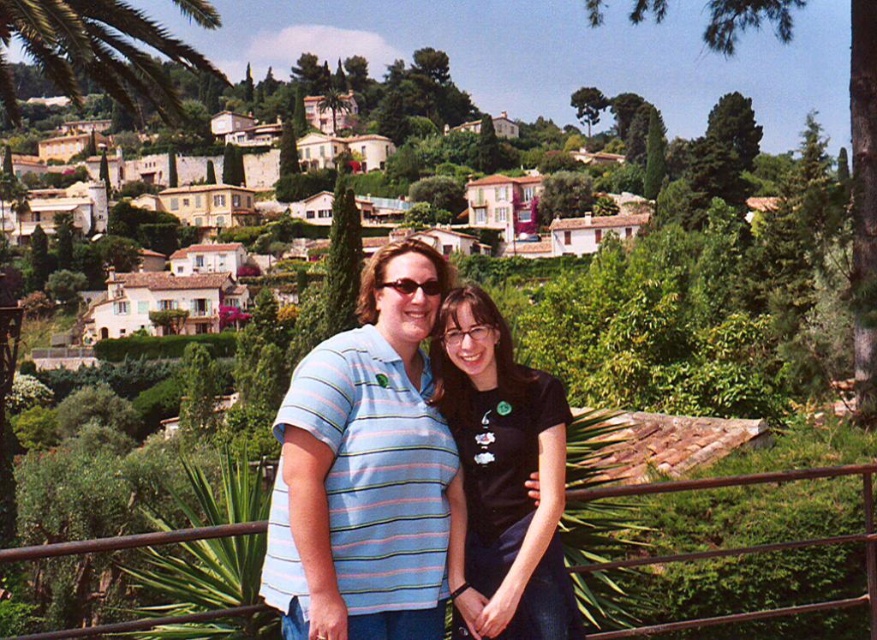
You are a photographer trying to capture a group photo of the two people in the scene. The photographer wants to ensure that the person wearing the black matte shirt at center is positioned exactly at the point marked by coordinates point (x=505, y=470). Based on the scene description, can you confirm if the black matte shirt at center is already positioned correctly at that point?

Yes, the black matte shirt at center is located at point (x=505, y=470), so it is already positioned correctly at that coordinate.

You are a photographer trying to capture the striped cotton shirt at center and the green leafy palm tree at upper left in the same frame. Which object should you position your camera closer to in order to include both in the shot?

To include both the striped cotton shirt at center and the green leafy palm tree at upper left in the same frame, you should position your camera closer to the green leafy palm tree at upper left since the striped cotton shirt at center is located to its right.